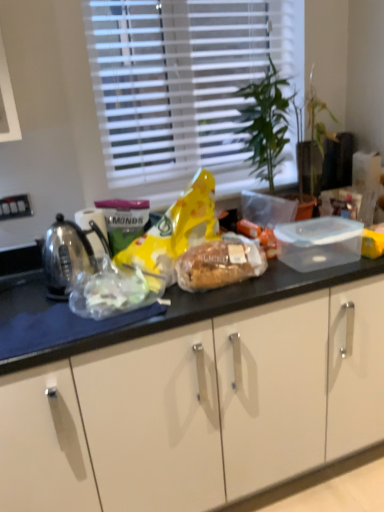
Question: Is translucent plastic bag at left taller or shorter than polished stainless steel kettle at left?

Choices:
 (A) tall
 (B) short

Answer: (B)

Question: From the image's perspective, is translucent plastic bag at left positioned above or below polished stainless steel kettle at left?

Choices:
 (A) above
 (B) below

Answer: (B)

Question: Estimate the real-world distances between objects in this image. Which object is farther from the translucent plastic bread at center?

Choices:
 (A) translucent plastic bag at left
 (B) polished stainless steel kettle at left
 (C) white blinds at upper center

Answer: (C)

Question: Which object is the farthest from the polished stainless steel kettle at left?

Choices:
 (A) white blinds at upper center
 (B) translucent plastic bag at left
 (C) translucent plastic bread at center

Answer: (A)